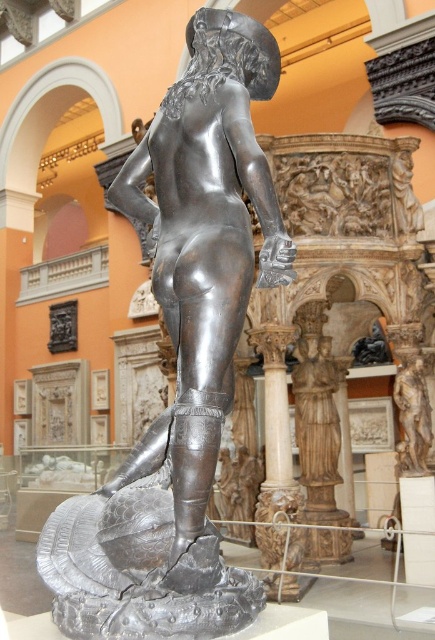
You are an art conservator examining the sculpture in the museum. You need to locate the exact point at coordinates (315, 413) on the sculpture. Based on the description, which part of the sculpture is this point likely located on?

The point at coordinates (315, 413) corresponds to the polished wood statue at center, so it is likely located on the central part of the sculpture.

You are an art conservator examining the sculpture from the front. You notice two points marked on the sculpture at coordinates point (187, 172) and point (321, 410). Which of these points is closer to you when viewed from the front?

Point (187, 172) is in front of point (321, 410), so it is closer to you when viewed from the front.